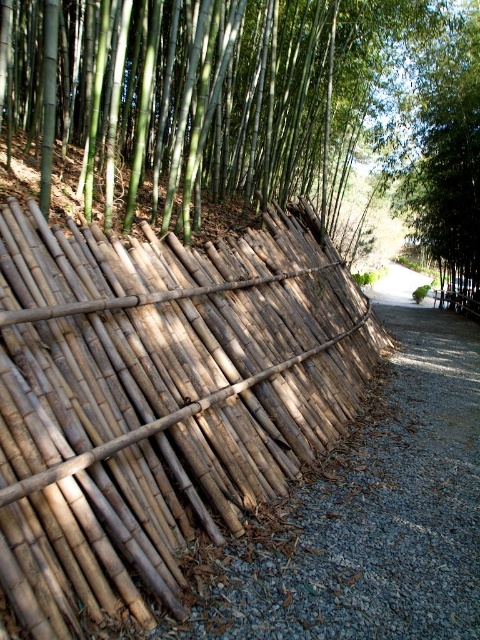
Question: Is natural bamboo fence at left above green leafy tree at upper right?

Choices:
 (A) yes
 (B) no

Answer: (B)

Question: Observing the image, what is the correct spatial positioning of natural bamboo fence at left in reference to green leafy tree at upper right?

Choices:
 (A) above
 (B) below

Answer: (B)

Question: Which object is farther from the camera taking this photo?

Choices:
 (A) green leafy tree at upper right
 (B) natural bamboo fence at left

Answer: (A)

Question: Is natural bamboo fence at left further to camera compared to green leafy tree at upper right?

Choices:
 (A) no
 (B) yes

Answer: (A)